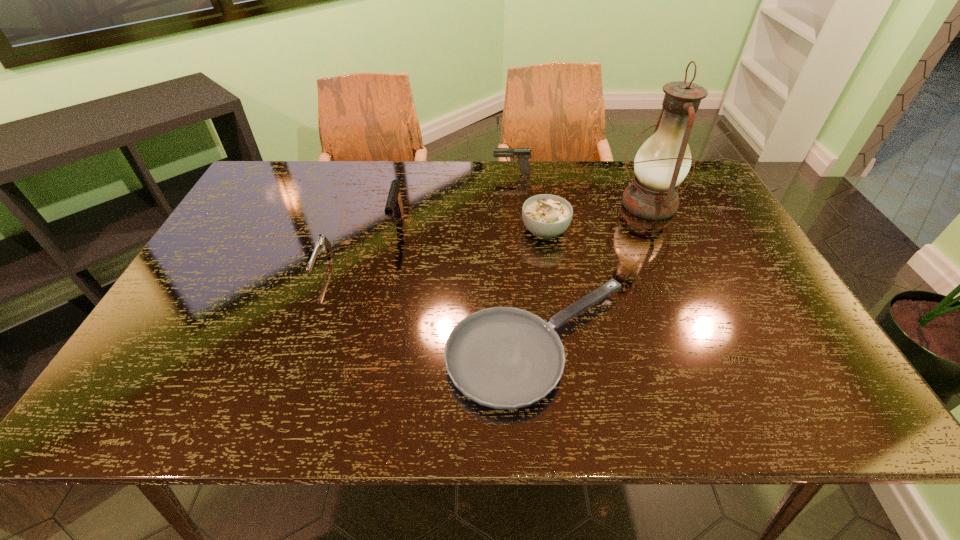
Identify the location of free space in the image that satisfies the following two spatial constraints: 1. aim along the barrel of the second tallest pistol; 2. on the right side of the oil lamp. (515, 204).

Locate an element on the screen. free space in the image that satisfies the following two spatial constraints: 1. aim along the barrel of the rightmost object; 2. on the left side of the farthest object is located at coordinates (515, 204).

You are a GUI agent. You are given a task and a screenshot of the screen. Output one action in this format:
    pyautogui.click(x=<x>, y=<y>)
    Task: Click on the free point that satisfies the following two spatial constraints: 1. on the back side of the tallest object; 2. on the left side of the frying pan
    The height and width of the screenshot is (540, 960).
    Given the screenshot: What is the action you would take?
    [523, 204]